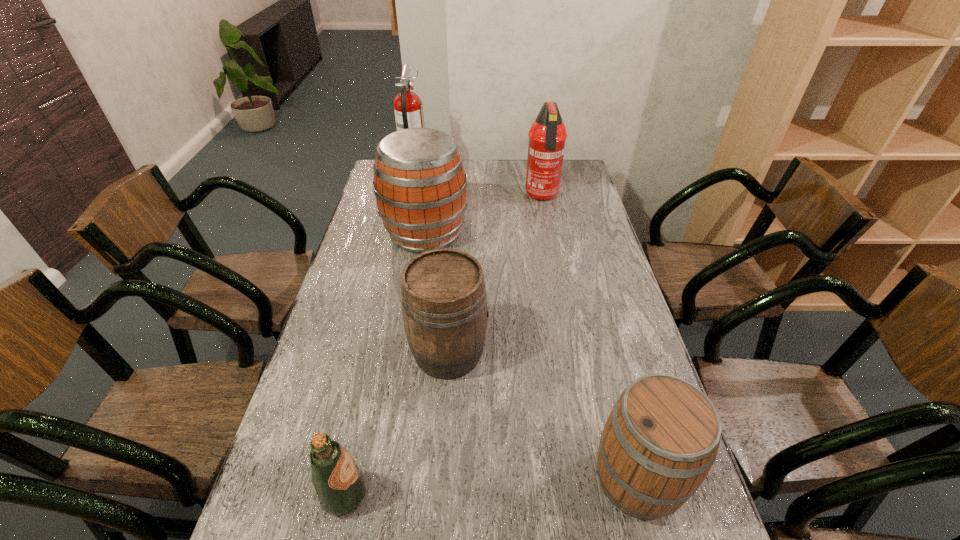
This screenshot has height=540, width=960. What are the coordinates of `the taller fire extinguisher` in the screenshot? It's located at (408, 108).

This screenshot has width=960, height=540. What are the coordinates of `the farther fire extinguisher` in the screenshot? It's located at (408, 108).

Image resolution: width=960 pixels, height=540 pixels. I want to click on the nearer fire extinguisher, so click(x=547, y=135).

Locate an element on the screen. Image resolution: width=960 pixels, height=540 pixels. the second farthest object is located at coordinates (547, 135).

Locate an element on the screen. This screenshot has height=540, width=960. the tallest cider is located at coordinates (420, 186).

The width and height of the screenshot is (960, 540). I want to click on the farthest cider, so click(x=420, y=186).

Identify the location of the third nearest object. The height and width of the screenshot is (540, 960). (444, 303).

I want to click on the rightmost cider, so click(x=661, y=439).

Locate an element on the screen. This screenshot has width=960, height=540. olive oil is located at coordinates (339, 483).

Locate an element on the screen. The image size is (960, 540). free space located on the nozzle side of the farthest object is located at coordinates (517, 172).